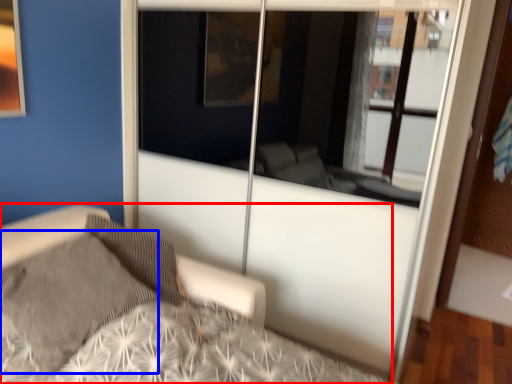
Question: Which of the following is the closest to the observer, bed (highlighted by a red box) or pillow (highlighted by a blue box)?

Choices:
 (A) bed
 (B) pillow

Answer: (A)